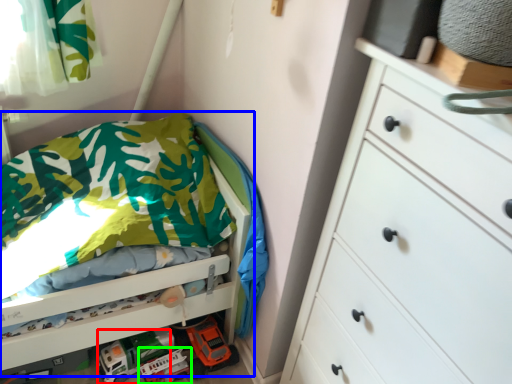
Question: Estimate the real-world distances between objects in this image. Which object is closer to toy car (highlighted by a red box), bed (highlighted by a blue box) or toy car (highlighted by a green box)?

Choices:
 (A) bed
 (B) toy car

Answer: (B)